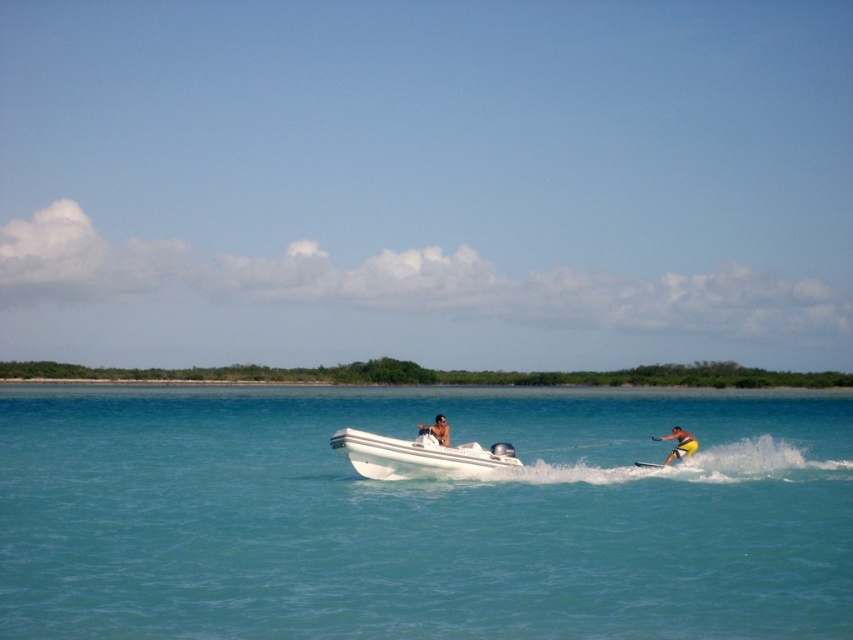
Question: Which object is positioned farthest from the yellow fabric surfboard at lower right?

Choices:
 (A) tan skin human at center
 (B) white matte boat at center

Answer: (A)

Question: From the image, what is the correct spatial relationship of yellow fabric surfboard at lower right in relation to tan skin human at center?

Choices:
 (A) right
 (B) left

Answer: (A)

Question: Which point appears closest to the camera in this image?

Choices:
 (A) (677, 428)
 (B) (221, 504)

Answer: (B)

Question: Can you confirm if white matte boat at center is thinner than tan skin human at center?

Choices:
 (A) yes
 (B) no

Answer: (B)

Question: Is white matte boat at center bigger than yellow fabric surfboard at lower right?

Choices:
 (A) yes
 (B) no

Answer: (B)

Question: Which object is positioned closest to the white smooth water at center?

Choices:
 (A) white matte boat at center
 (B) tan skin human at center

Answer: (A)